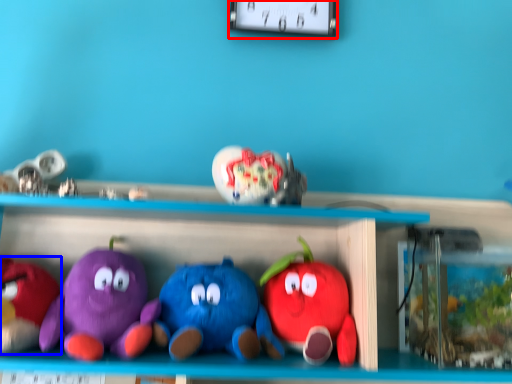
Question: Which object appears closest to the camera in this image, clock (highlighted by a red box) or toy (highlighted by a blue box)?

Choices:
 (A) clock
 (B) toy

Answer: (B)